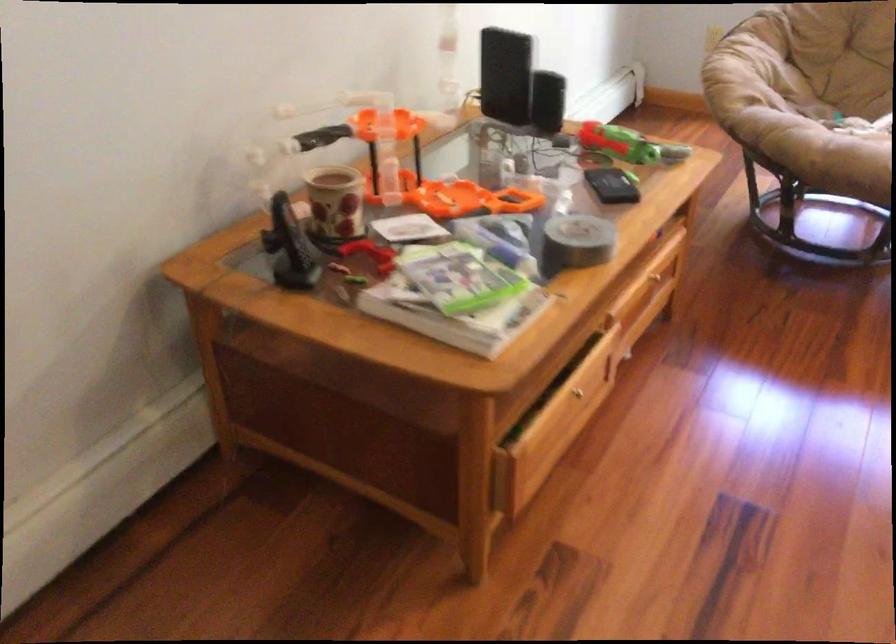
Where is `chair sitting surface`? chair sitting surface is located at coordinates (842, 118).